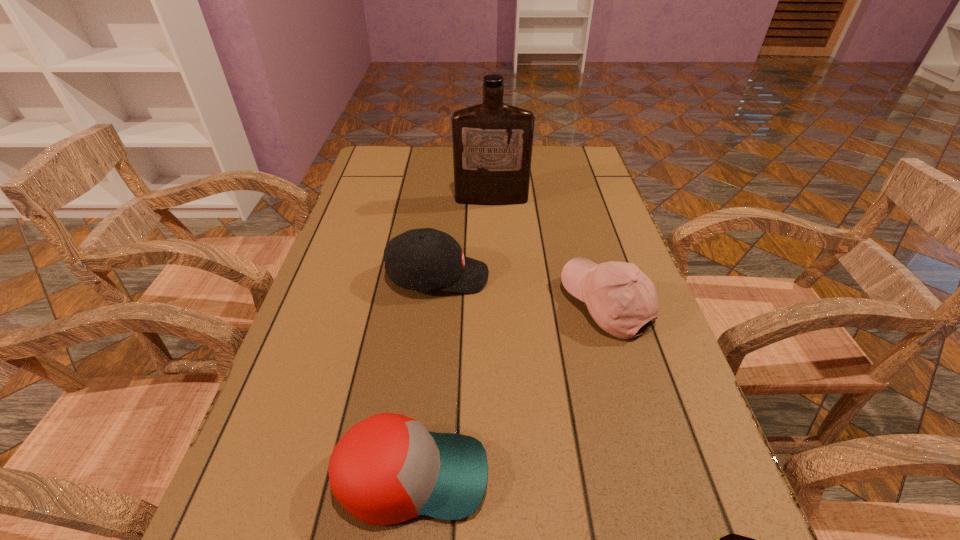
Identify the location of object that is the third closest one to the shortest baseball cap. point(426,259).

Locate an element on the screen. The image size is (960, 540). baseball cap object that ranks as the closest to the second nearest object is located at coordinates (621, 299).

Locate which baseball cap ranks in proximity to the patty. Please provide its 2D coordinates. Your answer should be formatted as a tuple, i.e. [(x, y)], where the tuple contains the x and y coordinates of a point satisfying the conditions above.

[(388, 468)]